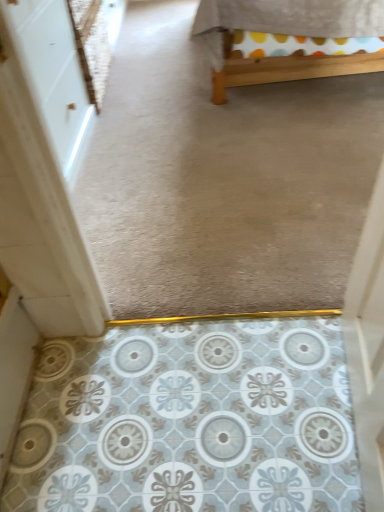
Question: In the image, is white glossy door at left positioned in front of or behind wooden bed frame at upper center?

Choices:
 (A) behind
 (B) front

Answer: (B)

Question: Is white glossy door at left bigger or smaller than wooden bed frame at upper center?

Choices:
 (A) small
 (B) big

Answer: (A)

Question: Which is correct: white glossy door at left is inside wooden bed frame at upper center, or outside of it?

Choices:
 (A) outside
 (B) inside

Answer: (A)

Question: In terms of height, does wooden bed frame at upper center look taller or shorter compared to white glossy door at left?

Choices:
 (A) tall
 (B) short

Answer: (B)

Question: In terms of size, does wooden bed frame at upper center appear bigger or smaller than white glossy door at left?

Choices:
 (A) small
 (B) big

Answer: (B)

Question: From a real-world perspective, relative to white glossy door at left, is wooden bed frame at upper center vertically above or below?

Choices:
 (A) above
 (B) below

Answer: (B)

Question: Is wooden bed frame at upper center wider or thinner than white glossy door at left?

Choices:
 (A) thin
 (B) wide

Answer: (B)